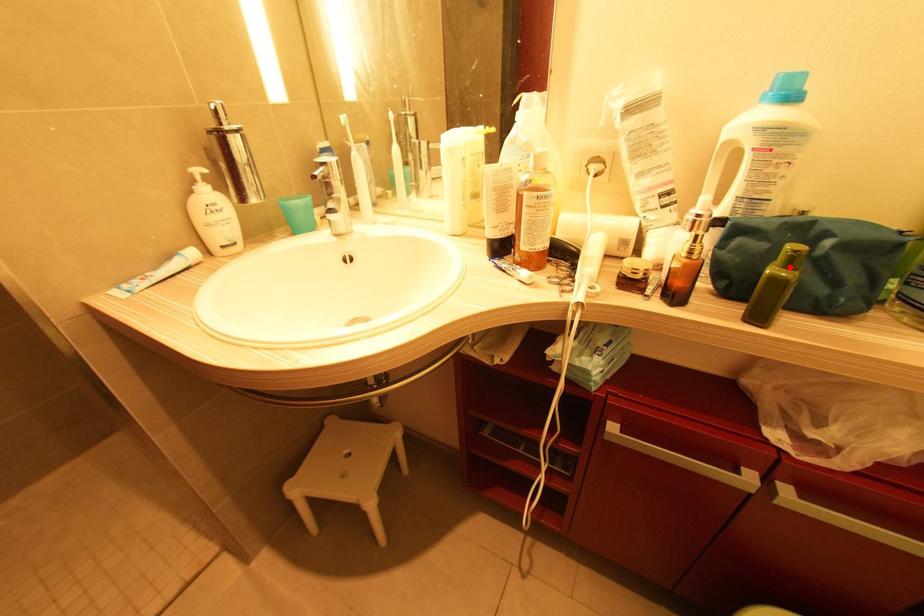
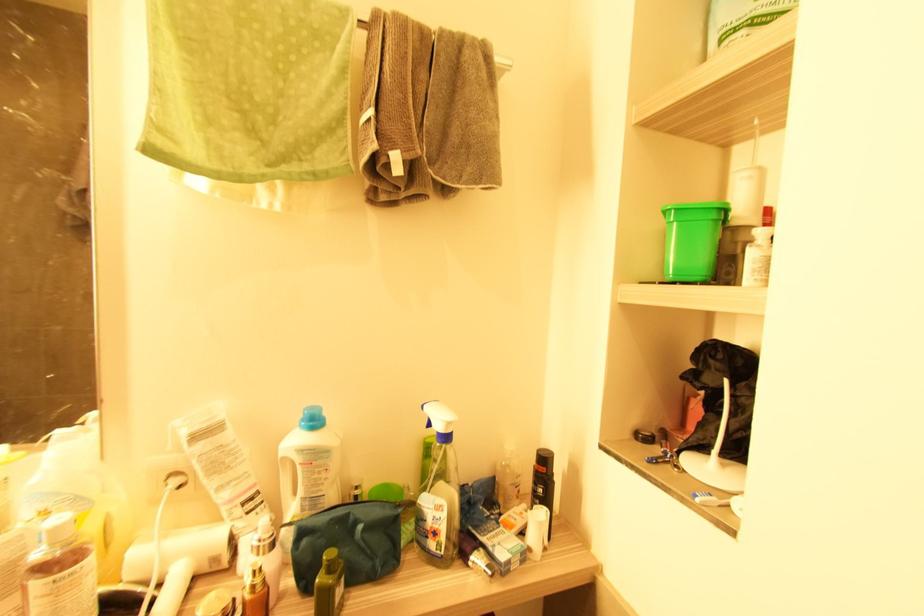
Locate, in the second image, the point that corresponds to the highlighted location in the first image.

(331, 572)